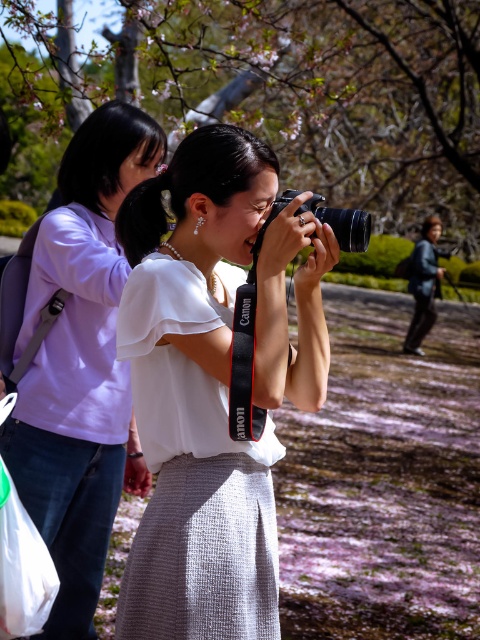
Question: Considering the relative positions of matte white shirt at upper left and dark gray fabric jacket at right in the image provided, where is matte white shirt at upper left located with respect to dark gray fabric jacket at right?

Choices:
 (A) above
 (B) below

Answer: (B)

Question: Which of these objects is positioned closest to the dark gray fabric jacket at right?

Choices:
 (A) black plastic camera at center
 (B) slightly glossy brown tree at upper center
 (C) white textured dress at center
 (D) matte white shirt at upper left

Answer: (D)

Question: Based on their relative distances, which object is farther from the black plastic camera at center?

Choices:
 (A) matte white shirt at upper left
 (B) dark gray fabric jacket at right
 (C) slightly glossy brown tree at upper center

Answer: (C)

Question: Is slightly glossy brown tree at upper center above black plastic camera at center?

Choices:
 (A) no
 (B) yes

Answer: (B)

Question: Which object appears closest to the camera in this image?

Choices:
 (A) black plastic camera at center
 (B) slightly glossy brown tree at upper center
 (C) matte white shirt at upper left

Answer: (A)

Question: Is matte white shirt at upper left below white textured dress at center?

Choices:
 (A) no
 (B) yes

Answer: (A)